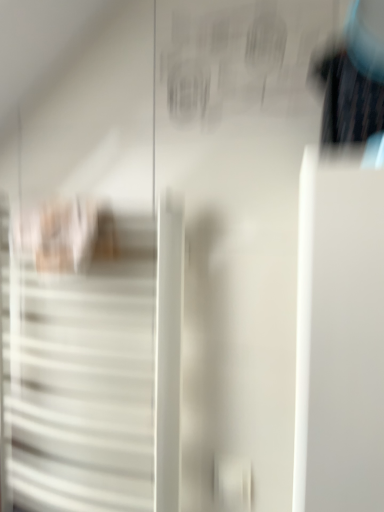
Question: Is black glossy hairbrush at upper right at the left side of white matte door at left?

Choices:
 (A) yes
 (B) no

Answer: (B)

Question: Is black glossy hairbrush at upper right oriented away from white matte door at left?

Choices:
 (A) yes
 (B) no

Answer: (B)

Question: Does black glossy hairbrush at upper right lie behind white matte door at left?

Choices:
 (A) no
 (B) yes

Answer: (A)

Question: From the image's perspective, is black glossy hairbrush at upper right under white matte door at left?

Choices:
 (A) yes
 (B) no

Answer: (B)

Question: Is white matte door at left a part of black glossy hairbrush at upper right?

Choices:
 (A) yes
 (B) no

Answer: (B)

Question: From the image's perspective, is black glossy hairbrush at upper right on top of white matte door at left?

Choices:
 (A) no
 (B) yes

Answer: (B)

Question: Is white matte door at left behind black glossy hairbrush at upper right?

Choices:
 (A) no
 (B) yes

Answer: (B)

Question: From the image's perspective, is white matte door at left located beneath black glossy hairbrush at upper right?

Choices:
 (A) no
 (B) yes

Answer: (B)

Question: Is white matte door at left to the right of black glossy hairbrush at upper right from the viewer's perspective?

Choices:
 (A) no
 (B) yes

Answer: (A)

Question: Does white matte door at left have a greater width compared to black glossy hairbrush at upper right?

Choices:
 (A) yes
 (B) no

Answer: (B)

Question: Is black glossy hairbrush at upper right completely or partially inside white matte door at left?

Choices:
 (A) no
 (B) yes

Answer: (A)

Question: From a real-world perspective, is white matte door at left over black glossy hairbrush at upper right?

Choices:
 (A) yes
 (B) no

Answer: (B)

Question: Is black glossy hairbrush at upper right inside or outside of white matte door at left?

Choices:
 (A) outside
 (B) inside

Answer: (A)